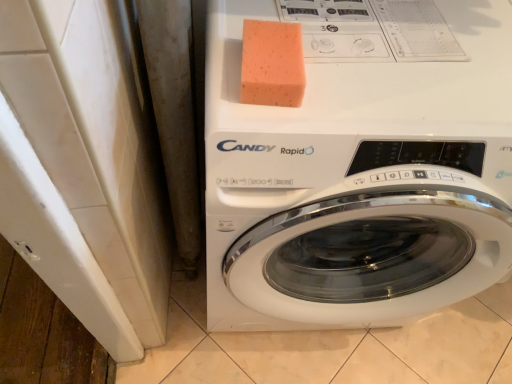
At what (x,y) coordinates should I click in order to perform the action: click on vacant area that lies in front of orange sponge at upper center. Please return your answer as a coordinate pair (x, y). Looking at the image, I should click on pyautogui.click(x=265, y=119).